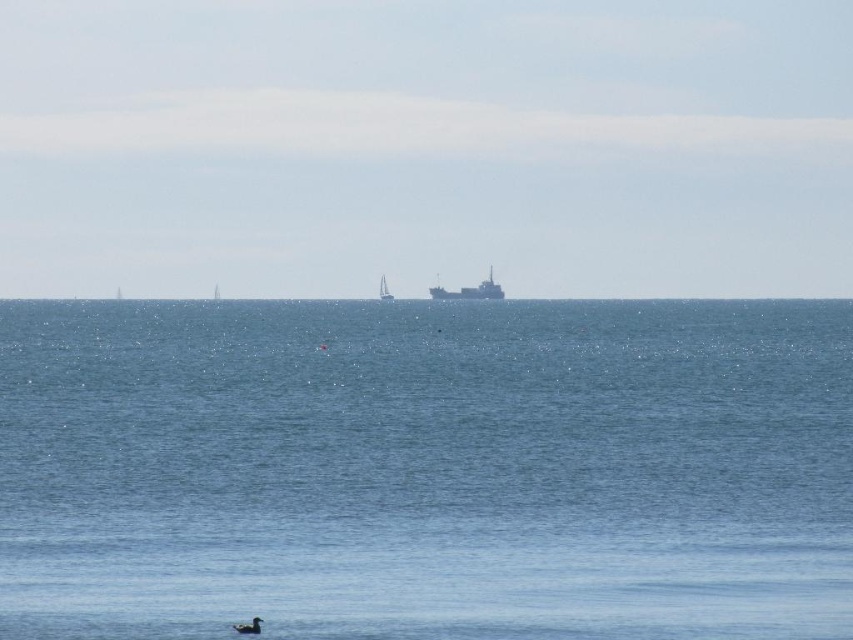
You are an observer standing on the shore looking at the seascape. You notice the blue water at center and the white plastic sailboat at center. Which object is wider?

The blue water at center is wider than the white plastic sailboat at center.

You are standing on the deck of a cruise ship and see the blue water at center and the white plastic sailboat at center. Which object is closer to you?

The blue water at center is closer to you since it is only 487.20 feet away from the white plastic sailboat at center, meaning the blue water at center is in front of the white plastic sailboat at center.

You are standing on a cliff overlooking the sea and see the blue water at center and the white plastic sailboat at center. Which object is closer to you?

The blue water at center is closer to you because it is in front of the white plastic sailboat at center.